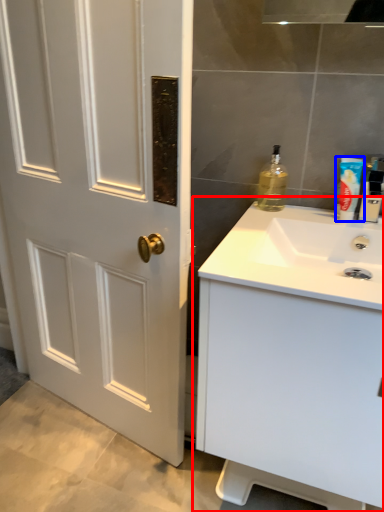
Question: Which object appears farthest to the camera in this image, bathroom cabinet (highlighted by a red box) or mouthwash (highlighted by a blue box)?

Choices:
 (A) bathroom cabinet
 (B) mouthwash

Answer: (B)